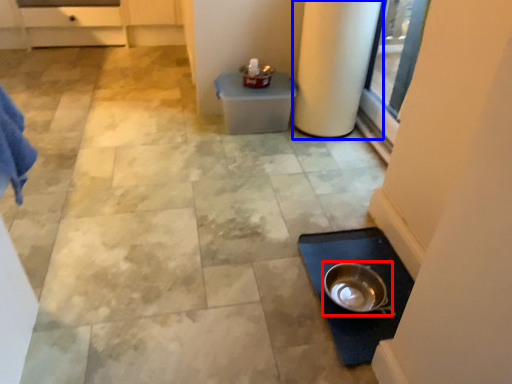
Question: Which of the following is the closest to the observer, mixing bowl (highlighted by a red box) or pillar (highlighted by a blue box)?

Choices:
 (A) mixing bowl
 (B) pillar

Answer: (A)